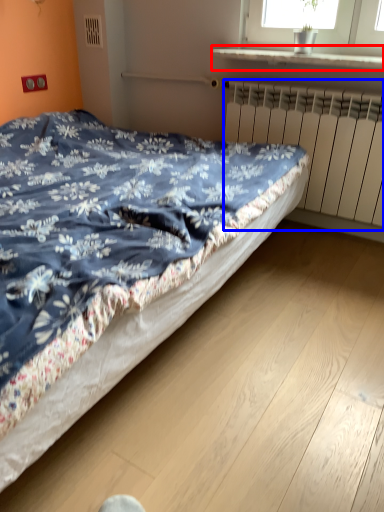
Question: Which point is closer to the camera, window sill (highlighted by a red box) or radiator (highlighted by a blue box)?

Choices:
 (A) window sill
 (B) radiator

Answer: (A)